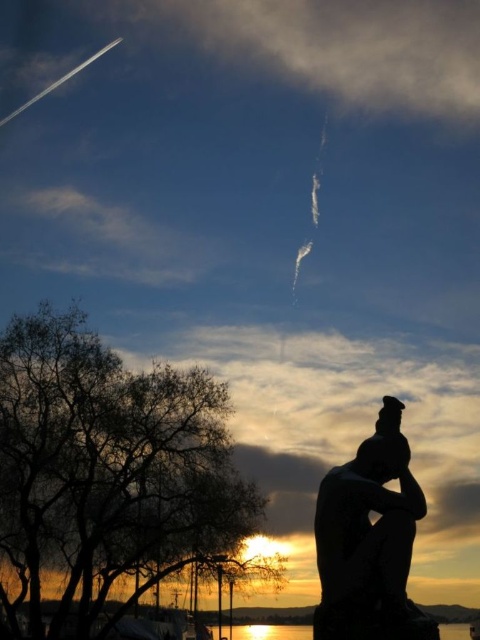
You are an artist trying to sketch this sunset scene. You want to ensure the silhouette statue at lower right and the glistening water at lower center are proportionally accurate. Which object should you draw first if you want to start with the wider one?

The glistening water at lower center should be drawn first since it is wider than the silhouette statue at lower right according to the description.

You are standing at the point with coordinates (370, 540). What object is located exactly at your current position?

The silhouette statue at lower right is located exactly at the point with coordinates (370, 540).